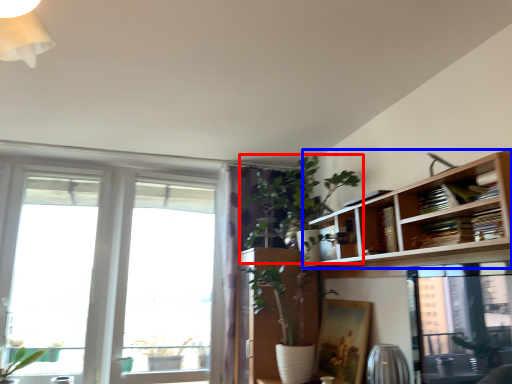
Question: Which of the following is the closest to the observer, houseplant (highlighted by a red box) or bookshelf (highlighted by a blue box)?

Choices:
 (A) houseplant
 (B) bookshelf

Answer: (B)